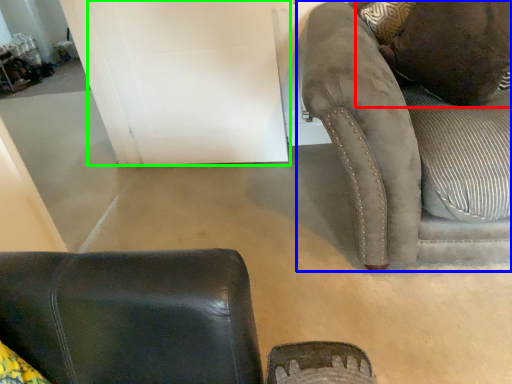
Question: Which object is the closest to the pillow (highlighted by a red box)? Choose among these: studio couch (highlighted by a blue box) or door (highlighted by a green box).

Choices:
 (A) studio couch
 (B) door

Answer: (A)